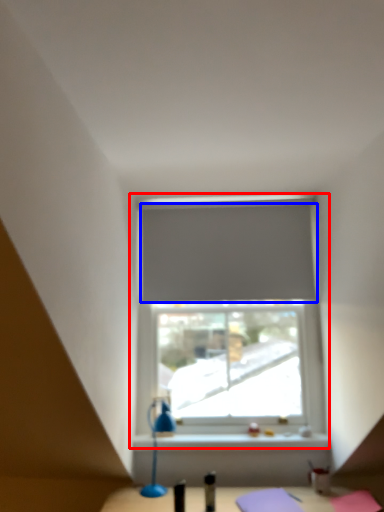
Question: Which object is closer to the camera taking this photo, window (highlighted by a red box) or curtain (highlighted by a blue box)?

Choices:
 (A) window
 (B) curtain

Answer: (A)